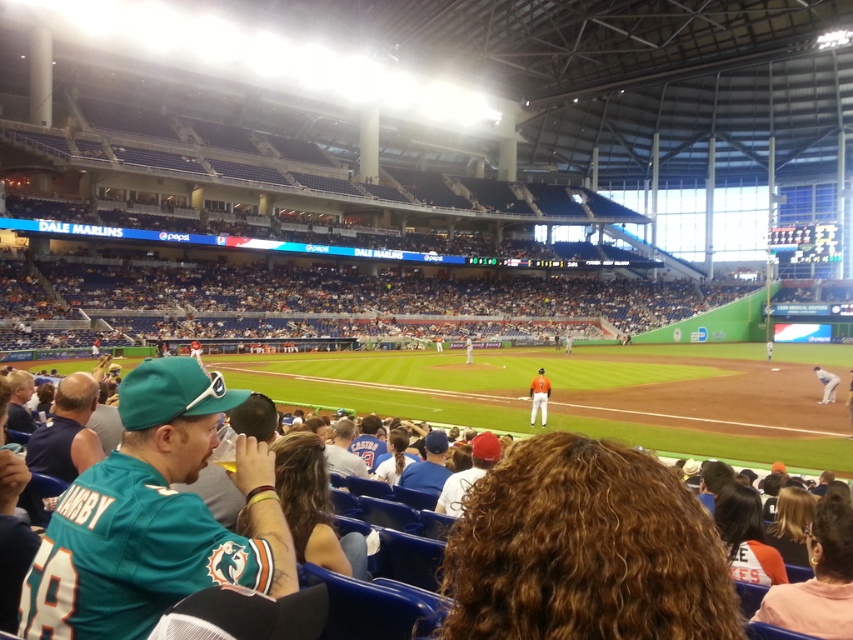
Can you confirm if orange jersey at center is bigger than white jersey at center?

Actually, orange jersey at center might be smaller than white jersey at center.

Is orange jersey at center below white jersey at center?

Yes.

I want to click on orange jersey at center, so click(538, 396).

Is orange jersey at center to the right of white jersey at right from the viewer's perspective?

In fact, orange jersey at center is to the left of white jersey at right.

Can you confirm if orange jersey at center is positioned to the left of white jersey at right?

Yes, orange jersey at center is to the left of white jersey at right.

Which is in front, point (537, 408) or point (825, 390)?

Point (537, 408) is more forward.

Locate an element on the screen. This screenshot has width=853, height=640. orange jersey at center is located at coordinates (538, 396).

Is white jersey at right closer to camera compared to white jersey at center?

Yes.

Does white jersey at right have a greater width compared to white jersey at center?

Correct, the width of white jersey at right exceeds that of white jersey at center.

What do you see at coordinates (827, 385) in the screenshot?
I see `white jersey at right` at bounding box center [827, 385].

What are the coordinates of `white jersey at right` in the screenshot? It's located at (827, 385).